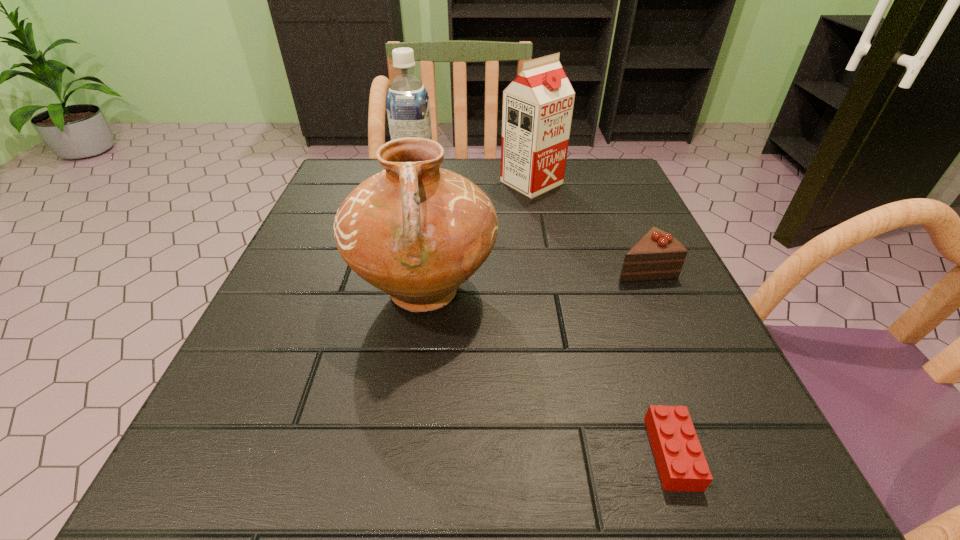
Identify the location of vacant space located on the back of the shortest object. (609, 269).

This screenshot has height=540, width=960. Find the location of `object located at the near edge`. object located at the near edge is located at coordinates (682, 466).

The width and height of the screenshot is (960, 540). In order to click on soya milk that is positioned at the left edge in this screenshot , I will do `click(408, 108)`.

Image resolution: width=960 pixels, height=540 pixels. Find the location of `pottery at the left edge`. pottery at the left edge is located at coordinates (417, 232).

Identify the location of soya milk that is positioned at the right edge. (538, 104).

This screenshot has height=540, width=960. In order to click on chocolate cake that is at the right edge in this screenshot , I will do `click(657, 255)`.

I want to click on Lego that is at the right edge, so click(x=682, y=466).

Where is `object located in the far left corner section of the desktop`? This screenshot has height=540, width=960. object located in the far left corner section of the desktop is located at coordinates (408, 108).

This screenshot has width=960, height=540. I want to click on object located in the far right corner section of the desktop, so click(538, 104).

Image resolution: width=960 pixels, height=540 pixels. Find the location of `object at the near right corner`. object at the near right corner is located at coordinates (682, 466).